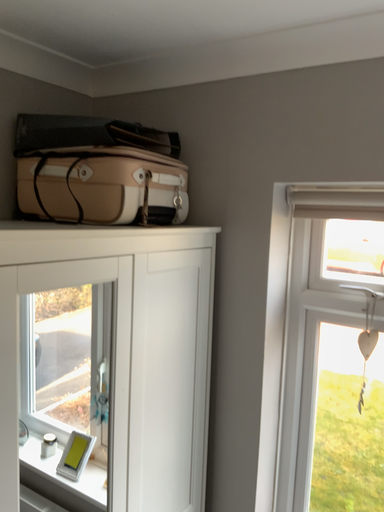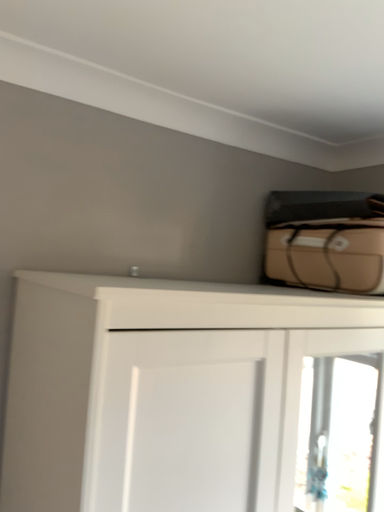
Question: How did the camera likely rotate when shooting the video?

Choices:
 (A) rotated right
 (B) rotated left

Answer: (B)